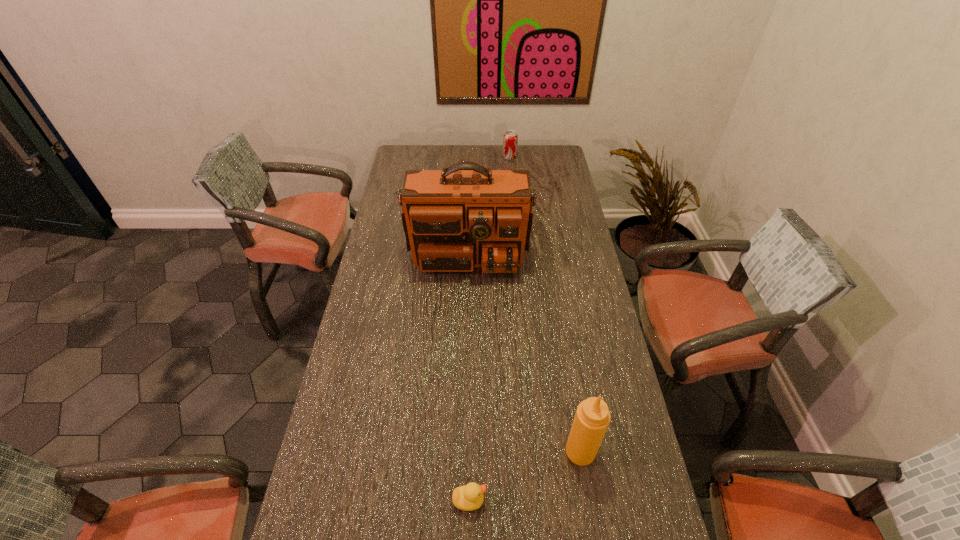
I want to click on unoccupied area between the nearest object and the second farthest object, so click(x=469, y=369).

What are the coordinates of `free point between the farthest object and the third farthest object` in the screenshot? It's located at (545, 304).

This screenshot has height=540, width=960. Identify the location of vacant space that is in between the soda can and the rightmost object. (545, 304).

Find the location of a particular element. vacant space that's between the shortest object and the tallest object is located at coordinates (469, 369).

Where is `free area in between the condiment and the nearest object`? The width and height of the screenshot is (960, 540). free area in between the condiment and the nearest object is located at coordinates (525, 476).

Find the location of `object that is the closest to the third farthest object`. object that is the closest to the third farthest object is located at coordinates (469, 497).

The image size is (960, 540). Find the location of `object that is the closest to the condiment`. object that is the closest to the condiment is located at coordinates (469, 497).

This screenshot has width=960, height=540. I want to click on free spot that satisfies the following two spatial constraints: 1. on the front side of the farthest object; 2. on the right side of the condiment, so click(x=537, y=451).